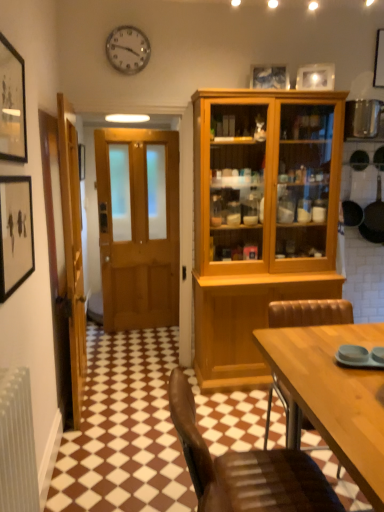
Find the location of `black non-stick frying pan at right`. black non-stick frying pan at right is located at coordinates click(374, 218).

Describe the element at coordinates (374, 218) in the screenshot. I see `black non-stick frying pan at right` at that location.

This screenshot has width=384, height=512. What do you see at coordinates (15, 233) in the screenshot?
I see `matte black picture frame at left, the 4th picture frame positioned from the right` at bounding box center [15, 233].

Image resolution: width=384 pixels, height=512 pixels. What do you see at coordinates (309, 313) in the screenshot? I see `brown leather chair at lower right, which is the 2th chair in front-to-back order` at bounding box center [309, 313].

Locate an element on the screen. white glossy picture frame at upper center, which is the fourth picture frame from front to back is located at coordinates (316, 77).

From the image's perspective, is black non-stick frying pan at right on matte black picture frame at left, which is the third picture frame from back to front?

Indeed, from the image's perspective, black non-stick frying pan at right is shown above matte black picture frame at left, which is the third picture frame from back to front.

Which is behind, black non-stick frying pan at right or matte black picture frame at left, the 4th picture frame positioned from the right?

Positioned behind is black non-stick frying pan at right.

Between black non-stick frying pan at right and matte black picture frame at left, which ranks as the 4th picture frame in top-to-bottom order, which one appears on the right side from the viewer's perspective?

From the viewer's perspective, black non-stick frying pan at right appears more on the right side.

Is point (377, 200) positioned in front of point (2, 252)?

That is False.

Does point (268, 66) come closer to viewer compared to point (309, 324)?

No.

There is a matte wooden picture frame at upper center, the 2th picture frame from the back. Where is `the 1st chair below it (from the image's perspective)`? The height and width of the screenshot is (512, 384). the 1st chair below it (from the image's perspective) is located at coordinates (309, 313).

Considering the relative sizes of matte wooden picture frame at upper center, which is the second picture frame from right to left, and brown leather chair at lower right, placed as the 1th chair when sorted from back to front, in the image provided, is matte wooden picture frame at upper center, which is the second picture frame from right to left, smaller than brown leather chair at lower right, placed as the 1th chair when sorted from back to front,?

Indeed, matte wooden picture frame at upper center, which is the second picture frame from right to left, has a smaller size compared to brown leather chair at lower right, placed as the 1th chair when sorted from back to front.

From the image's perspective, does matte wooden picture frame at upper center, positioned as the third picture frame in left-to-right order, appear lower than brown leather chair at lower right, which is the 2th chair in front-to-back order?

Actually, matte wooden picture frame at upper center, positioned as the third picture frame in left-to-right order, appears above brown leather chair at lower right, which is the 2th chair in front-to-back order, in the image.

Which point is more distant from viewer, (0, 225) or (273, 83)?

The point (273, 83) is behind.

Is matte black picture frame at left, marked as the 2th picture frame in a front-to-back arrangement, thinner than matte wooden picture frame at upper center, the 2th picture frame from the back?

Yes, matte black picture frame at left, marked as the 2th picture frame in a front-to-back arrangement, is thinner than matte wooden picture frame at upper center, the 2th picture frame from the back.

Considering the positions of objects matte black picture frame at left, marked as the 2th picture frame in a front-to-back arrangement, and matte wooden picture frame at upper center, which is the second picture frame from right to left, in the image provided, who is behind, matte black picture frame at left, marked as the 2th picture frame in a front-to-back arrangement, or matte wooden picture frame at upper center, which is the second picture frame from right to left,?

matte wooden picture frame at upper center, which is the second picture frame from right to left, is further from the camera.

Would you say matte wooden picture frame at upper center, positioned as the third picture frame in left-to-right order, is part of matte black picture frame at left, which ranks as the 4th picture frame in top-to-bottom order,'s contents?

No, matte wooden picture frame at upper center, positioned as the third picture frame in left-to-right order, is not a part of matte black picture frame at left, which ranks as the 4th picture frame in top-to-bottom order.

Considering the relative sizes of brown leather chair at lower center, which is counted as the 1th chair, starting from the front, and wooden picture frame at upper left, which is the fourth picture frame from back to front, in the image provided, is brown leather chair at lower center, which is counted as the 1th chair, starting from the front, smaller than wooden picture frame at upper left, which is the fourth picture frame from back to front,?

No.

Which object is further away from the camera taking this photo, brown leather chair at lower center, the 2th chair from the back, or wooden picture frame at upper left, placed as the third picture frame when sorted from top to bottom?

wooden picture frame at upper left, placed as the third picture frame when sorted from top to bottom, is further away from the camera.

From a real-world perspective, is brown leather chair at lower center, the 2th chair from the back, physically located above or below wooden picture frame at upper left, the 2th picture frame ordered from the bottom?

brown leather chair at lower center, the 2th chair from the back, is below wooden picture frame at upper left, the 2th picture frame ordered from the bottom.

Based on the photo, visually, is brown leather chair at lower center, the 2th chair from the back, positioned to the left or to the right of wooden picture frame at upper left, the 1th picture frame when ordered from front to back?

Clearly, brown leather chair at lower center, the 2th chair from the back, is on the right of wooden picture frame at upper left, the 1th picture frame when ordered from front to back, in the image.

Is matte wooden picture frame at upper center, the 2th picture frame from the back, taller or shorter than black non-stick frying pan at right?

Considering their sizes, matte wooden picture frame at upper center, the 2th picture frame from the back, has less height than black non-stick frying pan at right.

From a real-world perspective, is matte wooden picture frame at upper center, marked as the third picture frame in a front-to-back arrangement, on top of black non-stick frying pan at right?

Yes, from a real-world perspective, matte wooden picture frame at upper center, marked as the third picture frame in a front-to-back arrangement, is over black non-stick frying pan at right

Consider the image. From the image's perspective, is matte wooden picture frame at upper center, the 2th picture frame from the back, positioned above or below black non-stick frying pan at right?

Clearly, from the image's perspective, matte wooden picture frame at upper center, the 2th picture frame from the back, is above black non-stick frying pan at right.

Does matte wooden picture frame at upper center, which is the fourth picture frame from bottom to top, have a smaller size compared to black non-stick frying pan at right?

Correct, matte wooden picture frame at upper center, which is the fourth picture frame from bottom to top, occupies less space than black non-stick frying pan at right.

Is matte black picture frame at left, marked as the 2th picture frame in a front-to-back arrangement, touching brown leather chair at lower right, placed as the 1th chair when sorted from back to front?

matte black picture frame at left, marked as the 2th picture frame in a front-to-back arrangement, and brown leather chair at lower right, placed as the 1th chair when sorted from back to front, are clearly separated.

Considering the positions of objects matte black picture frame at left, marked as the 2th picture frame in a front-to-back arrangement, and brown leather chair at lower right, placed as the 1th chair when sorted from back to front, in the image provided, who is more to the right, matte black picture frame at left, marked as the 2th picture frame in a front-to-back arrangement, or brown leather chair at lower right, placed as the 1th chair when sorted from back to front,?

brown leather chair at lower right, placed as the 1th chair when sorted from back to front, is more to the right.

From the image's perspective, between matte black picture frame at left, marked as the 2th picture frame in a front-to-back arrangement, and brown leather chair at lower right, placed as the 1th chair when sorted from back to front, who is located below?

brown leather chair at lower right, placed as the 1th chair when sorted from back to front, is shown below in the image.

Between wooden picture frame at upper left, which is the fourth picture frame from back to front, and matte black picture frame at left, which ranks as the 4th picture frame in top-to-bottom order, which one has larger width?

wooden picture frame at upper left, which is the fourth picture frame from back to front, is wider.

Which of these two, wooden picture frame at upper left, the 1th picture frame when ordered from front to back, or matte black picture frame at left, the 4th picture frame positioned from the right, stands taller?

Standing taller between the two is matte black picture frame at left, the 4th picture frame positioned from the right.

From the image's perspective, is wooden picture frame at upper left, the 2th picture frame ordered from the bottom, above matte black picture frame at left, which is the third picture frame from back to front?

Correct, wooden picture frame at upper left, the 2th picture frame ordered from the bottom, appears higher than matte black picture frame at left, which is the third picture frame from back to front, in the image.

Which point is more forward, (1, 157) or (18, 254)?

Positioned in front is point (1, 157).

From the black non-stick frying pan at right, count 3rd picture frames forward and point to it. Please provide its 2D coordinates.

[(15, 233)]

The width and height of the screenshot is (384, 512). There is a matte wooden picture frame at upper center, placed as the 1th picture frame when sorted from top to bottom. Identify the location of the 1st chair below it (from the image's perspective). (309, 313).

Estimate the real-world distances between objects in this image. Which object is further from matte black picture frame at left, which ranks as the 4th picture frame in top-to-bottom order, brown leather chair at lower center, which is counted as the 1th chair, starting from the front, or wooden door at left, which is counted as the first door, starting from the left?

brown leather chair at lower center, which is counted as the 1th chair, starting from the front.

Which object lies nearer to the anchor point wooden door at left, which is counted as the first door, starting from the left, brown leather chair at lower center, the 2th chair from the back, or black non-stick frying pan at right?

brown leather chair at lower center, the 2th chair from the back, lies closer to wooden door at left, which is counted as the first door, starting from the left, than the other object.

Which object lies further to the anchor point matte wooden picture frame at upper center, which is the second picture frame from right to left, wooden door at left, which ranks as the second door in right-to-left order, or metallic clock at upper center?

Among the two, wooden door at left, which ranks as the second door in right-to-left order, is located further to matte wooden picture frame at upper center, which is the second picture frame from right to left.

From the image, which object appears to be farther from brown leather chair at lower center, the 2th chair from the back, matte black picture frame at left, positioned as the 1th picture frame in bottom-to-top order, or wooden picture frame at upper left, the 2th picture frame ordered from the bottom?

Based on the image, wooden picture frame at upper left, the 2th picture frame ordered from the bottom, appears to be further to brown leather chair at lower center, the 2th chair from the back.

Estimate the real-world distances between objects in this image. Which object is closer to white glossy picture frame at upper center, which is the fourth picture frame from front to back, wooden door at left, which is counted as the first door, starting from the left, or wooden picture frame at upper left, the third picture frame positioned from the right?

wooden door at left, which is counted as the first door, starting from the left, is closer to white glossy picture frame at upper center, which is the fourth picture frame from front to back.

Based on their spatial positions, is matte black picture frame at left, the 4th picture frame positioned from the right, or matte wooden picture frame at upper center, positioned as the third picture frame in left-to-right order, closer to metallic clock at upper center?

The object closer to metallic clock at upper center is matte wooden picture frame at upper center, positioned as the third picture frame in left-to-right order.

When comparing their distances from brown leather chair at lower center, the 2th chair from the back, does black non-stick frying pan at right or wooden door at left, which is counted as the first door, starting from the left, seem further?

The object further to brown leather chair at lower center, the 2th chair from the back, is black non-stick frying pan at right.

When comparing their distances from brown leather chair at lower right, placed as the 1th chair when sorted from back to front, does brown leather chair at lower center, which is counted as the 1th chair, starting from the front, or matte black picture frame at left, positioned as the 1th picture frame in bottom-to-top order, seem further?

A: Among the two, matte black picture frame at left, positioned as the 1th picture frame in bottom-to-top order, is located further to brown leather chair at lower right, placed as the 1th chair when sorted from back to front.

This screenshot has height=512, width=384. Identify the location of clock between matte black picture frame at left, the 4th picture frame positioned from the right, and matte wooden picture frame at upper center, which is the fourth picture frame from bottom to top, in the front-back direction. point(128,49).

Find the location of a particular element. The image size is (384, 512). picture frame between wooden picture frame at upper left, the 2th picture frame positioned from the left, and brown leather chair at lower center, the 2th chair from the back, in the up-down direction is located at coordinates (15, 233).

Where is `door between matte black picture frame at left, marked as the 2th picture frame in a front-to-back arrangement, and black non-stick frying pan at right`? door between matte black picture frame at left, marked as the 2th picture frame in a front-to-back arrangement, and black non-stick frying pan at right is located at coordinates (138, 226).

I want to click on frying pan that lies between metallic clock at upper center and brown leather chair at lower right, placed as the 1th chair when sorted from back to front, from top to bottom, so click(x=374, y=218).